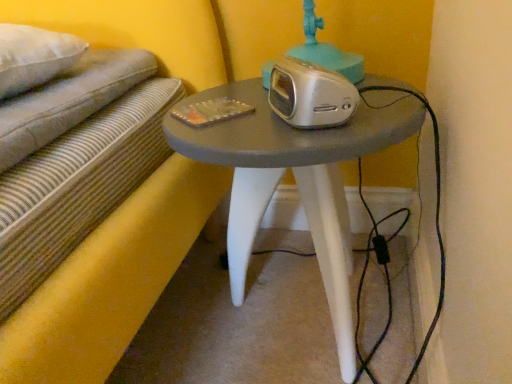
The image size is (512, 384). In order to click on vacant point above matte gray table at center (from a real-world perspective) in this screenshot , I will do `click(284, 103)`.